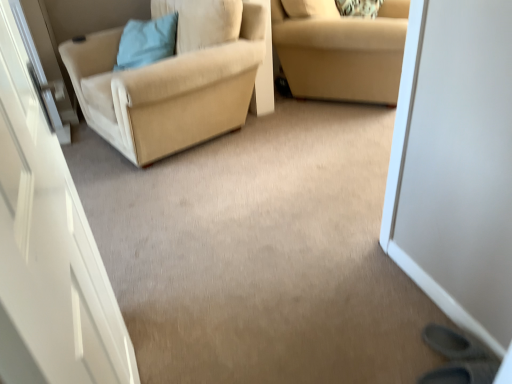
Question: From their relative heights in the image, would you say light blue fabric pillow at upper left is taller or shorter than beige fabric couch at upper right?

Choices:
 (A) tall
 (B) short

Answer: (B)

Question: Considering the positions of light blue fabric pillow at upper left and beige fabric couch at upper right in the image, is light blue fabric pillow at upper left bigger or smaller than beige fabric couch at upper right?

Choices:
 (A) small
 (B) big

Answer: (A)

Question: Which object is positioned farthest from the light blue fabric pillow at upper left?

Choices:
 (A) beige fabric couch at upper right
 (B) beige fabric chair at left

Answer: (A)

Question: Estimate the real-world distances between objects in this image. Which object is farther from the beige fabric couch at upper right?

Choices:
 (A) light blue fabric pillow at upper left
 (B) beige fabric chair at left

Answer: (A)